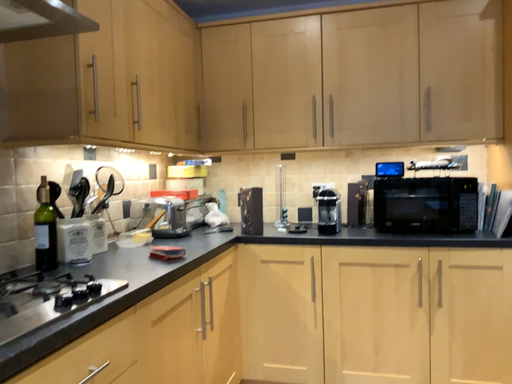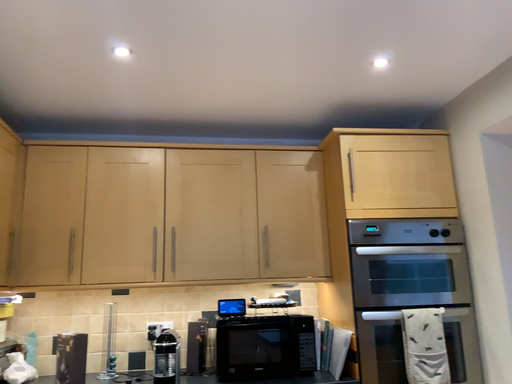
Question: How did the camera likely rotate when shooting the video?

Choices:
 (A) rotated downward
 (B) rotated upward

Answer: (B)